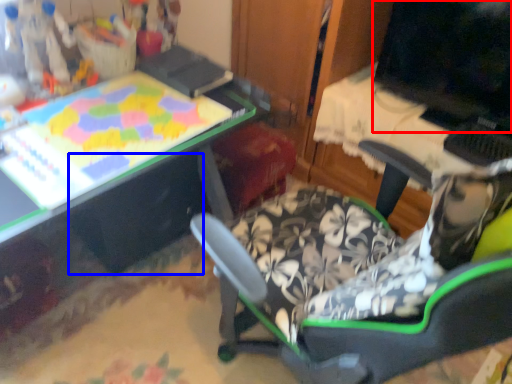
Question: Which of the following is the farthest to the observer, computer monitor (highlighted by a red box) or drawer (highlighted by a blue box)?

Choices:
 (A) computer monitor
 (B) drawer

Answer: (B)